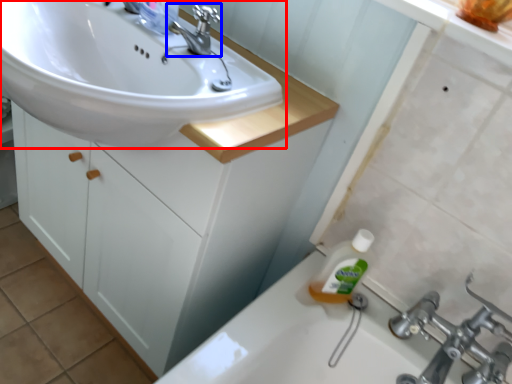
Question: Which object is further to the camera taking this photo, sink (highlighted by a red box) or tap (highlighted by a blue box)?

Choices:
 (A) sink
 (B) tap

Answer: (B)